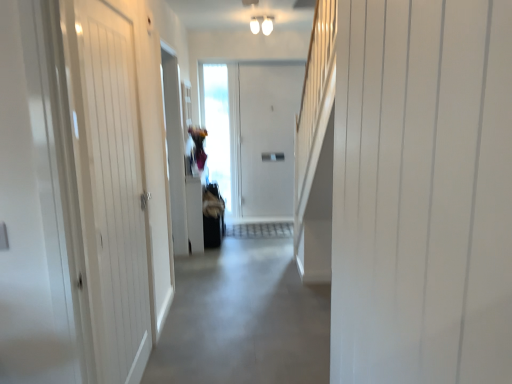
Question: Is gray concrete floor at center surrounded by white smooth door at right, the 2th door positioned from the left?

Choices:
 (A) no
 (B) yes

Answer: (A)

Question: From the image's perspective, is white smooth door at right, marked as the first door in a front-to-back arrangement, located above gray concrete floor at center?

Choices:
 (A) no
 (B) yes

Answer: (B)

Question: From the image's perspective, is white smooth door at right, marked as the first door in a front-to-back arrangement, beneath gray concrete floor at center?

Choices:
 (A) no
 (B) yes

Answer: (A)

Question: Considering the relative positions of white smooth door at right, which is the 2th door in back-to-front order, and gray concrete floor at center in the image provided, is white smooth door at right, which is the 2th door in back-to-front order, to the left of gray concrete floor at center from the viewer's perspective?

Choices:
 (A) no
 (B) yes

Answer: (A)

Question: Considering the relative sizes of white smooth door at right, which is the 2th door in back-to-front order, and gray concrete floor at center in the image provided, is white smooth door at right, which is the 2th door in back-to-front order, wider than gray concrete floor at center?

Choices:
 (A) no
 (B) yes

Answer: (A)

Question: From a real-world perspective, is white smooth door at right, marked as the first door in a front-to-back arrangement, below gray concrete floor at center?

Choices:
 (A) no
 (B) yes

Answer: (A)

Question: Is white smooth door at right, marked as the first door in a front-to-back arrangement, at the right side of white wooden door at left, which appears as the second door when viewed from the front?

Choices:
 (A) no
 (B) yes

Answer: (B)

Question: Is white smooth door at right, the 2th door positioned from the left, bigger than white wooden door at left, which appears as the second door when viewed from the front?

Choices:
 (A) yes
 (B) no

Answer: (A)

Question: Does white smooth door at right, marked as the first door in a front-to-back arrangement, have a greater height compared to white wooden door at left, the first door when ordered from back to front?

Choices:
 (A) no
 (B) yes

Answer: (A)

Question: Is the position of white smooth door at right, the 2th door positioned from the left, more distant than that of white wooden door at left, the second door from the right?

Choices:
 (A) yes
 (B) no

Answer: (B)

Question: Does white smooth door at right, the 2th door positioned from the left, come in front of white wooden door at left, the second door from the right?

Choices:
 (A) yes
 (B) no

Answer: (A)

Question: From the image's perspective, is white smooth door at right, marked as the first door in a front-to-back arrangement, on white wooden door at left, the first door when ordered from back to front?

Choices:
 (A) no
 (B) yes

Answer: (A)

Question: Is gray concrete floor at center bigger than white wooden door at left, the second door from the right?

Choices:
 (A) no
 (B) yes

Answer: (B)